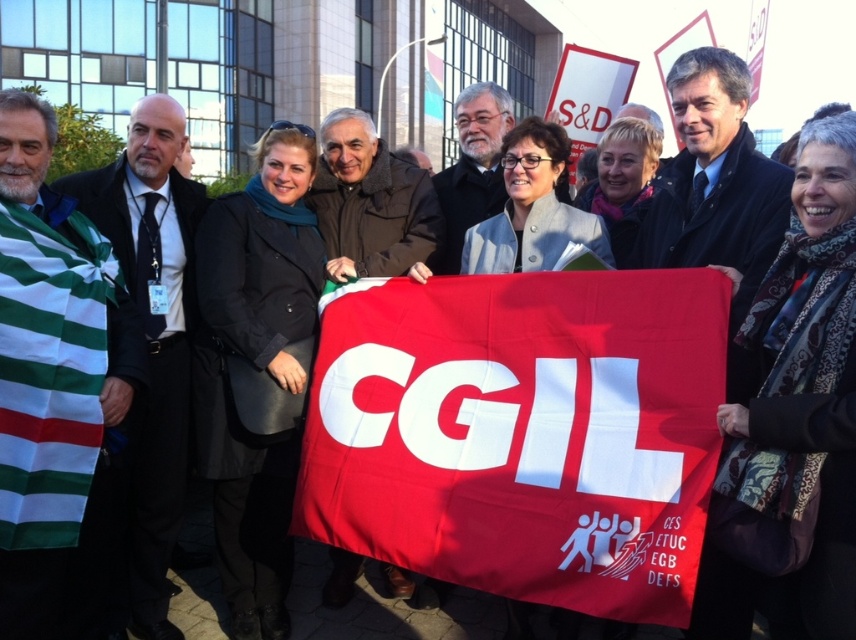
You are standing at the event and want to take a photo of the point marked at coordinates point (616,484). If your camera has a minimum focus distance of 10 feet, will you be able to focus on it?

The point (616,484) is 11.14 feet away from the viewer, which is beyond the camera minimum focus distance of 10 feet. Therefore, you can focus on it.